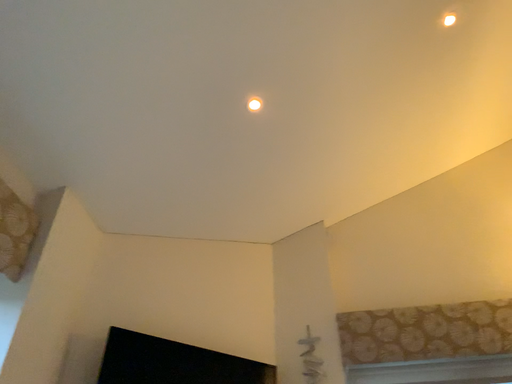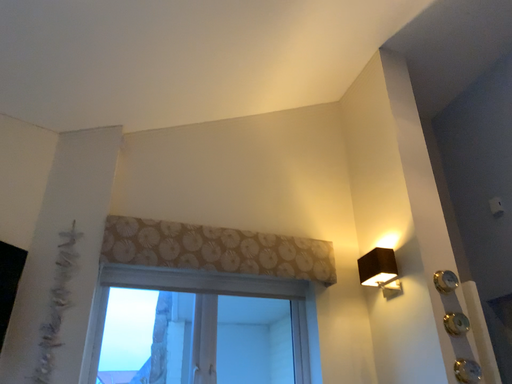
Question: Which way did the camera rotate in the video?

Choices:
 (A) rotated downward
 (B) rotated upward

Answer: (A)